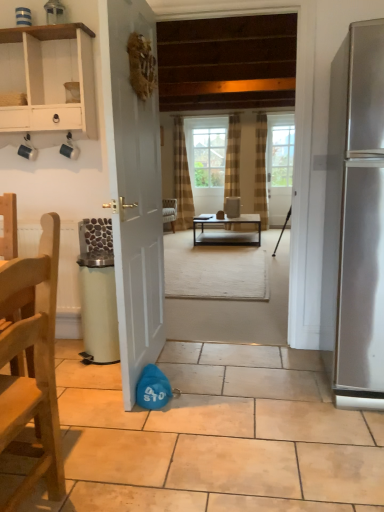
What do you see at coordinates (50, 80) in the screenshot?
I see `white wood cabinet at upper left` at bounding box center [50, 80].

Where is `white wood cabinet at upper left`? Image resolution: width=384 pixels, height=512 pixels. white wood cabinet at upper left is located at coordinates (50, 80).

What is the approximate height of wooden chair at left?

The height of wooden chair at left is 39.26 inches.

The height and width of the screenshot is (512, 384). What are the coordinates of `metallic silver desk at center` in the screenshot? It's located at (227, 231).

Measure the distance between point (155,187) and camera.

The depth of point (155,187) is 7.66 feet.

The width and height of the screenshot is (384, 512). What are the coordinates of `matte black coffee cup at upper left` in the screenshot? It's located at (27, 149).

From a real-world perspective, which is physically below, white wooden door at center, placed as the 1th door when sorted from right to left, or clear glass window screen at center?

white wooden door at center, placed as the 1th door when sorted from right to left, from a real-world perspective.

Can you confirm if white wooden door at center, which is the second door in left-to-right order, is wider than clear glass window screen at center?

Incorrect, the width of white wooden door at center, which is the second door in left-to-right order, does not surpass that of clear glass window screen at center.

Which object is positioned more to the right, white wooden door at center, the first door from the back, or clear glass window screen at center?

Positioned to the right is white wooden door at center, the first door from the back.

Based on the photo, measure the distance from white wood cabinet at upper left to wooden floor at center.

white wood cabinet at upper left and wooden floor at center are 4.43 feet apart.

From the image's perspective, which one is positioned lower, white wood cabinet at upper left or wooden floor at center?

wooden floor at center is shown below in the image.

Is white wood cabinet at upper left turned away from wooden floor at center?

No, white wood cabinet at upper left is not facing away from wooden floor at center.

Is white wood cabinet at upper left beside wooden floor at center?

There is a gap between white wood cabinet at upper left and wooden floor at center.

Considering the relative sizes of white wooden door at center, the first door from the back, and wooden chair at left in the image provided, is white wooden door at center, the first door from the back, bigger than wooden chair at left?

Incorrect, white wooden door at center, the first door from the back, is not larger than wooden chair at left.

What are the coordinates of `the 2nd door directly above the wooden chair at left (from a real-world perspective)` in the screenshot? It's located at (279, 166).

Is white wooden door at center, acting as the 2th door starting from the front, touching wooden chair at left?

There is a gap between white wooden door at center, acting as the 2th door starting from the front, and wooden chair at left.

Between white wooden door at center, the first door from the back, and wooden chair at left, which one appears on the right side from the viewer's perspective?

Positioned to the right is white wooden door at center, the first door from the back.

How distant is metallic silver desk at center from wooden chair at left?

metallic silver desk at center and wooden chair at left are 5.05 meters apart.

Is metallic silver desk at center bigger than wooden chair at left?

Yes.

From the image's perspective, between metallic silver desk at center and wooden chair at left, which one is located above?

metallic silver desk at center.

Can wooden chair at left be found inside metallic silver desk at center?

Definitely not — wooden chair at left is not inside metallic silver desk at center.

This screenshot has width=384, height=512. I want to click on cabinetry that appears above the green matte trash can at lower left (from the image's perspective), so click(50, 80).

Looking at this image, is white wood cabinet at upper left oriented away from green matte trash can at lower left?

No, white wood cabinet at upper left is not facing away from green matte trash can at lower left.

In the scene shown: Which of these two, white wood cabinet at upper left or green matte trash can at lower left, stands taller?

white wood cabinet at upper left.

Based on their sizes in the image, would you say white wood cabinet at upper left is bigger or smaller than green matte trash can at lower left?

In the image, white wood cabinet at upper left appears to be larger than green matte trash can at lower left.

From the picture: From a real-world perspective, which object rests below the other?

wooden floor at center is physically lower.

Between wooden floor at center and white wood cabinet at upper left, which one has more height?

wooden floor at center is taller.

Looking at this image, how many degrees apart are the facing directions of wooden floor at center and white wood cabinet at upper left?

0.328 degrees separate the facing orientations of wooden floor at center and white wood cabinet at upper left.

Between satin silver refrigerator at right and wooden chair at left, which one has smaller size?

Smaller between the two is wooden chair at left.

Is satin silver refrigerator at right positioned beyond the bounds of wooden chair at left?

That's correct, satin silver refrigerator at right is outside of wooden chair at left.

Considering the sizes of satin silver refrigerator at right and wooden chair at left in the image, is satin silver refrigerator at right wider or thinner than wooden chair at left?

Considering their sizes, satin silver refrigerator at right looks broader than wooden chair at left.

Which is more to the right, satin silver refrigerator at right or wooden chair at left?

satin silver refrigerator at right.

Where is `window screen on the left of white wooden door at center, the first door from the back`? This screenshot has width=384, height=512. window screen on the left of white wooden door at center, the first door from the back is located at coordinates (209, 157).

What are the coordinates of `terrace that is on the right side of white wood cabinet at upper left` in the screenshot? It's located at (230, 81).

Looking at this image, based on their spatial positions, is satin silver refrigerator at right or white matte door at center, the second door positioned from the right, closer to white wood cabinet at upper left?

Among the two, white matte door at center, the second door positioned from the right, is located nearer to white wood cabinet at upper left.

Based on their spatial positions, is white wooden door at center, which is the second door in left-to-right order, or white matte door at center, the second door positioned from the right, further from wooden floor at center?

Answer: Among the two, white wooden door at center, which is the second door in left-to-right order, is located further to wooden floor at center.

Looking at the image, which one is located closer to white wooden door at center, placed as the 1th door when sorted from right to left, green matte trash can at lower left or white matte door at center, placed as the first door when sorted from front to back?

Among the two, white matte door at center, placed as the first door when sorted from front to back, is located nearer to white wooden door at center, placed as the 1th door when sorted from right to left.

Estimate the real-world distances between objects in this image. Which object is further from clear glass window screen at center, brown textured curtain at center or satin silver refrigerator at right?

satin silver refrigerator at right is positioned further to the anchor clear glass window screen at center.

From the image, which object appears to be nearer to white wood cabinet at upper left, metallic silver desk at center or brown textured curtain at center?

metallic silver desk at center is positioned closer to the anchor white wood cabinet at upper left.

From the image, which object appears to be farther from metallic silver desk at center, green matte trash can at lower left or clear glass window screen at center?

Among the two, green matte trash can at lower left is located further to metallic silver desk at center.

Estimate the real-world distances between objects in this image. Which object is closer to wooden chair at left, brown textured curtain at center or wooden floor at center?

Among the two, wooden floor at center is located nearer to wooden chair at left.

From the image, which object appears to be farther from satin silver refrigerator at right, wooden chair at left or matte black coffee cup at upper left?

Among the two, matte black coffee cup at upper left is located further to satin silver refrigerator at right.

I want to click on trash bin/can between satin silver refrigerator at right and brown textured curtain at center from front to back, so click(98, 307).

Identify the location of trash bin/can between white wood cabinet at upper left and satin silver refrigerator at right. The image size is (384, 512). (98, 307).

I want to click on trash bin/can between white matte door at center, which ranks as the 1th door in left-to-right order, and brown textured curtain at center from front to back, so click(98, 307).

You are a GUI agent. You are given a task and a screenshot of the screen. Output one action in this format:
    pyautogui.click(x=<x>, y=<y>)
    Task: Click on the door between green matte trash can at lower left and satin silver refrigerator at right
    The image size is (384, 512).
    Given the screenshot: What is the action you would take?
    pyautogui.click(x=133, y=192)